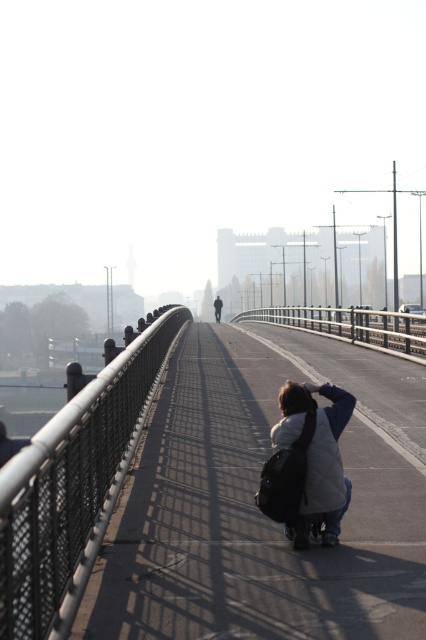
You are a photographer standing on the bridge and want to place your camera bag on the ground between the black mesh fence at center and the white matte jacket at lower center. If your camera bag requires 1.5 meters of space, will there be enough room?

The black mesh fence at center is 4.37 meters away from the white matte jacket at lower center, so yes, there is enough space to place the camera bag between them since the distance is greater than the required 1.5 meters.

You are a photographer standing on the bridge and want to capture a clear shot of the black metal rail at center without the black mesh fence at center blocking it. What should you do?

The black mesh fence at center is in front of the black metal rail at center, so you should move to a position where the black mesh fence at center is no longer between you and the black metal rail at center.

You are a photographer setting up your equipment on the bridge. You need to place your tripod between the black mesh fence at center and the black metal rail at center. Which object should you place the tripod closer to if you want to maximize the space between the fence and the rail?

You should place the tripod closer to the black mesh fence at center because it is thinner than the black metal rail at center, allowing more space between them.